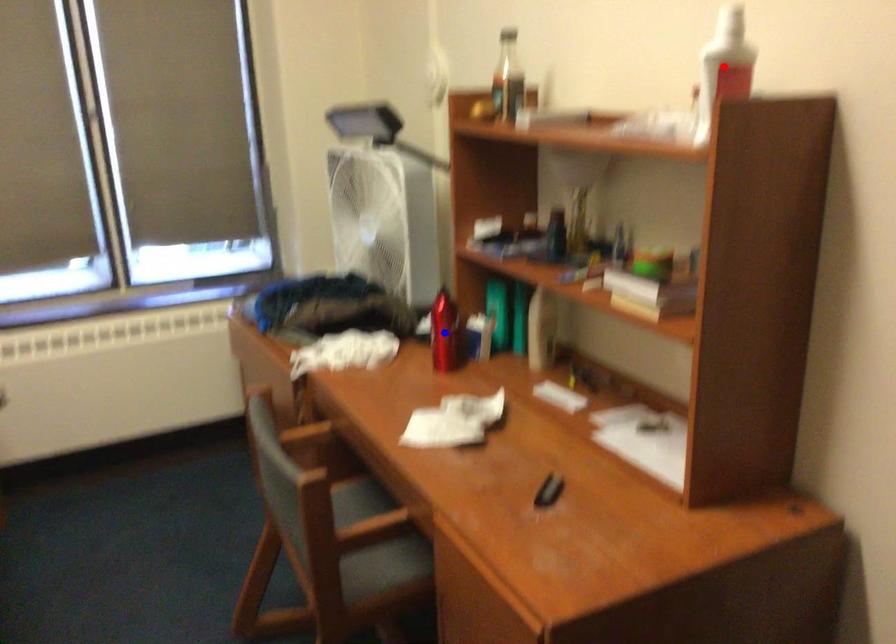
Question: In the image, two points are highlighted. Which point is nearer to the camera? Reply with the corresponding letter.

Choices:
 (A) blue point
 (B) red point

Answer: (B)